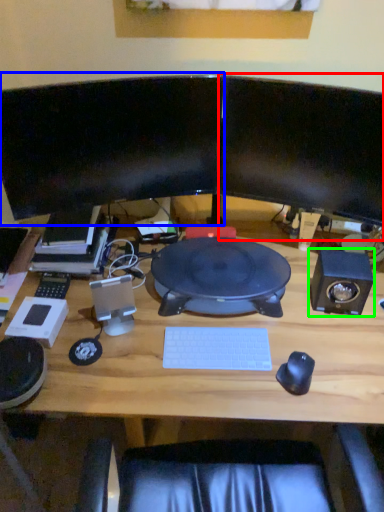
Question: Which is farther away from computer monitor (highlighted by a red box)? computer monitor (highlighted by a blue box) or speaker (highlighted by a green box)?

Choices:
 (A) computer monitor
 (B) speaker

Answer: (B)